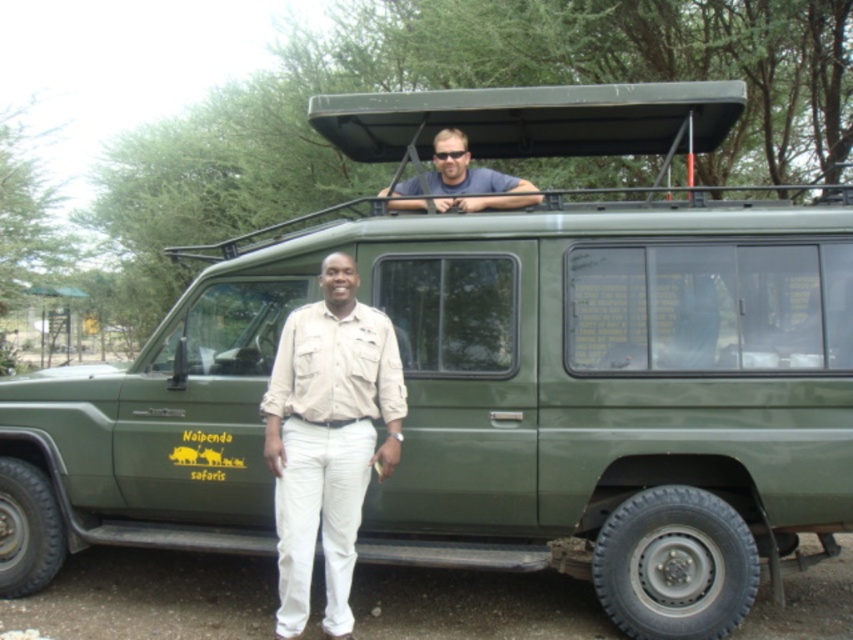
Question: Which of the following is the closest to the observer?

Choices:
 (A) (447, 205)
 (B) (335, 436)

Answer: (B)

Question: Which point is closer to the camera?

Choices:
 (A) (289, 467)
 (B) (474, 180)

Answer: (A)

Question: Can you confirm if khaki fabric shirt at center is positioned to the left of matte blue shirt at upper center?

Choices:
 (A) no
 (B) yes

Answer: (B)

Question: Which point appears farthest from the camera in this image?

Choices:
 (A) (349, 300)
 (B) (437, 200)

Answer: (B)

Question: Does khaki fabric shirt at center have a smaller size compared to matte blue shirt at upper center?

Choices:
 (A) yes
 (B) no

Answer: (B)

Question: Can you confirm if khaki fabric shirt at center is positioned above matte blue shirt at upper center?

Choices:
 (A) no
 (B) yes

Answer: (A)